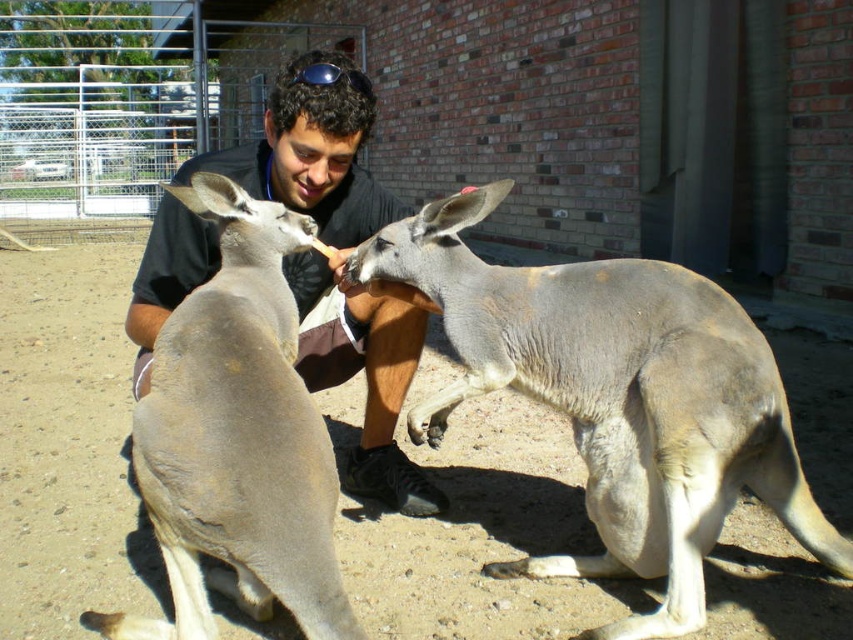
Which is more to the right, gray fur kangaroo at center or gray matte kangaroo at center?

gray fur kangaroo at center

I want to click on gray fur kangaroo at center, so click(616, 397).

Looking at this image, which is more to the right, smooth black shirt at center or sunglasses at center?

sunglasses at center

You are a GUI agent. You are given a task and a screenshot of the screen. Output one action in this format:
    pyautogui.click(x=<x>, y=<y>)
    Task: Click on the smooth black shirt at center
    
    Given the screenshot: What is the action you would take?
    pyautogui.click(x=338, y=268)

Between point (271, 96) and point (323, 65), which one is positioned in front?

Positioned in front is point (323, 65).

Locate an element on the screen. The height and width of the screenshot is (640, 853). smooth black shirt at center is located at coordinates (338, 268).

Is point (688, 608) positioned behind point (380, 394)?

No, it is not.

Can you confirm if gray fur kangaroo at center is positioned to the right of smooth black shirt at center?

Indeed, gray fur kangaroo at center is positioned on the right side of smooth black shirt at center.

What do you see at coordinates (616, 397) in the screenshot? I see `gray fur kangaroo at center` at bounding box center [616, 397].

Locate an element on the screen. The width and height of the screenshot is (853, 640). gray fur kangaroo at center is located at coordinates tap(616, 397).